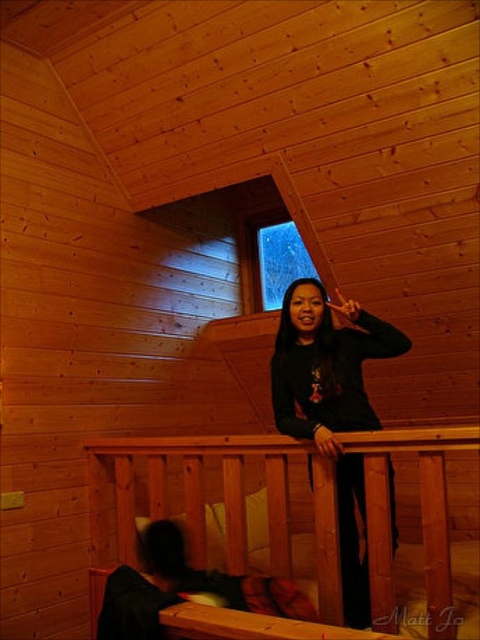
Does point (235, 477) lie behind point (391, 326)?

Yes, it is behind point (391, 326).

Can you confirm if wooden rail at upper center is positioned to the right of black matte hoodie at upper center?

In fact, wooden rail at upper center is to the left of black matte hoodie at upper center.

The height and width of the screenshot is (640, 480). In order to click on wooden rail at upper center in this screenshot , I will do `click(204, 500)`.

Is black matte hoodie at upper center thinner than transparent glass window at upper center?

Incorrect, black matte hoodie at upper center's width is not less than transparent glass window at upper center's.

Can you confirm if black matte hoodie at upper center is positioned to the left of transparent glass window at upper center?

In fact, black matte hoodie at upper center is to the right of transparent glass window at upper center.

Is point (348, 584) more distant than point (289, 278)?

No, (348, 584) is closer to viewer.

I want to click on black matte hoodie at upper center, so click(332, 406).

Who is higher up, wooden rail at upper center or transparent glass window at upper center?

transparent glass window at upper center is above.

Which is in front, point (377, 435) or point (296, 275)?

Point (377, 435)

This screenshot has height=640, width=480. In order to click on wooden rail at upper center in this screenshot , I will do `click(204, 500)`.